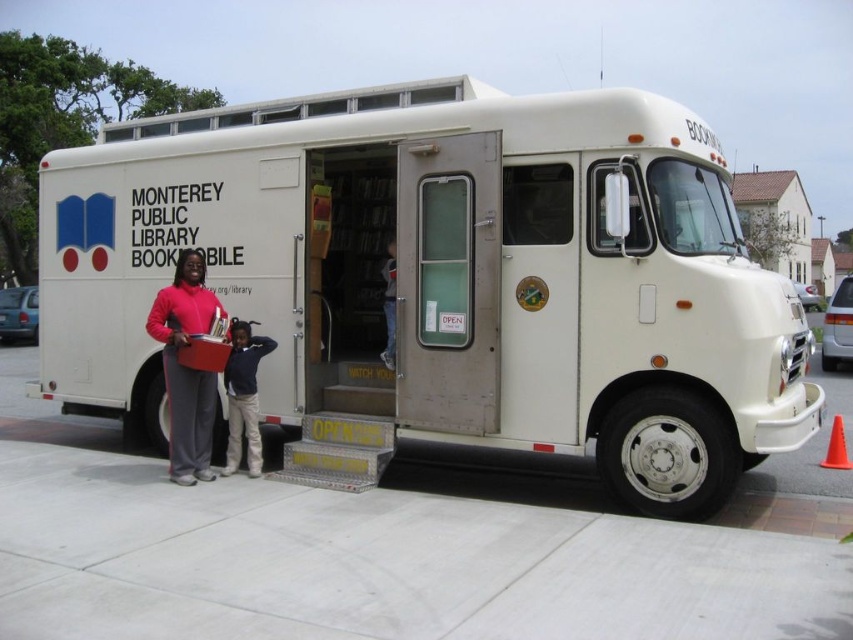
You are a delivery person trying to park your truck next to the white matte bookmobile at center and the matte pink sweater at center. Since the parking space is narrow, you need to know which object takes up more horizontal space. Which one is wider?

The white matte bookmobile at center has a lesser width compared to matte pink sweater at center, so the matte pink sweater at center is wider and would take up more horizontal space.

You are standing at the point with coordinates (442, 284). Based on the scene, where are you located?

The point (442, 284) is on the white matte bookmobile at center, so you are located on the bookmobile.